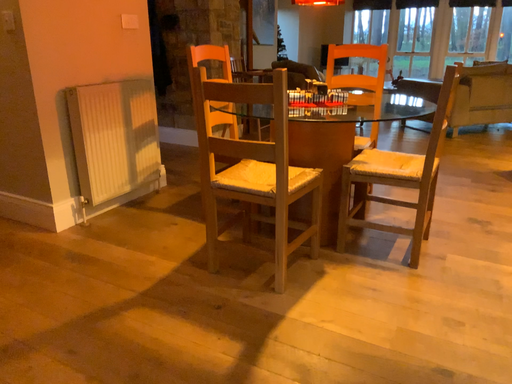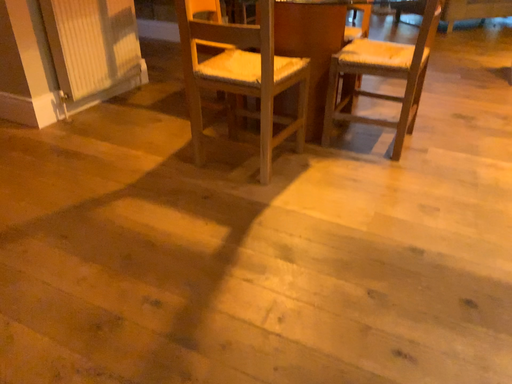
Question: How did the camera likely rotate when shooting the video?

Choices:
 (A) rotated upward
 (B) rotated downward

Answer: (B)